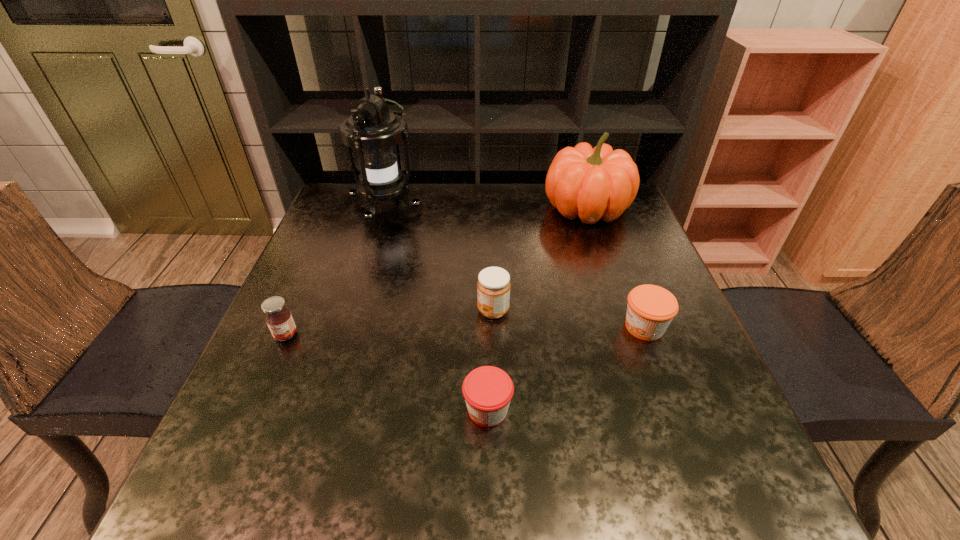
The width and height of the screenshot is (960, 540). In order to click on jam positioned at the right edge in this screenshot , I will do `click(650, 309)`.

Where is `object at the far left corner`? This screenshot has height=540, width=960. object at the far left corner is located at coordinates (373, 130).

At what (x,y) coordinates should I click in order to perform the action: click on object that is at the far right corner. Please return your answer as a coordinate pair (x, y). Looking at the image, I should click on (596, 183).

Locate an element on the screen. This screenshot has width=960, height=540. free space at the far edge is located at coordinates (447, 190).

This screenshot has width=960, height=540. I want to click on free space at the left edge of the desktop, so click(x=356, y=239).

This screenshot has width=960, height=540. In order to click on vacant space at the right edge of the desktop in this screenshot , I will do `click(611, 229)`.

This screenshot has height=540, width=960. I want to click on vacant space at the far left corner of the desktop, so click(336, 212).

Where is `vacant position at the near left corner of the desktop`? The width and height of the screenshot is (960, 540). vacant position at the near left corner of the desktop is located at coordinates (296, 483).

Image resolution: width=960 pixels, height=540 pixels. In the image, there is a desktop. Find the location of `vacant space at the near right corner`. vacant space at the near right corner is located at coordinates (740, 517).

Where is `free point between the rightmost jam and the leftmost object`? free point between the rightmost jam and the leftmost object is located at coordinates (465, 331).